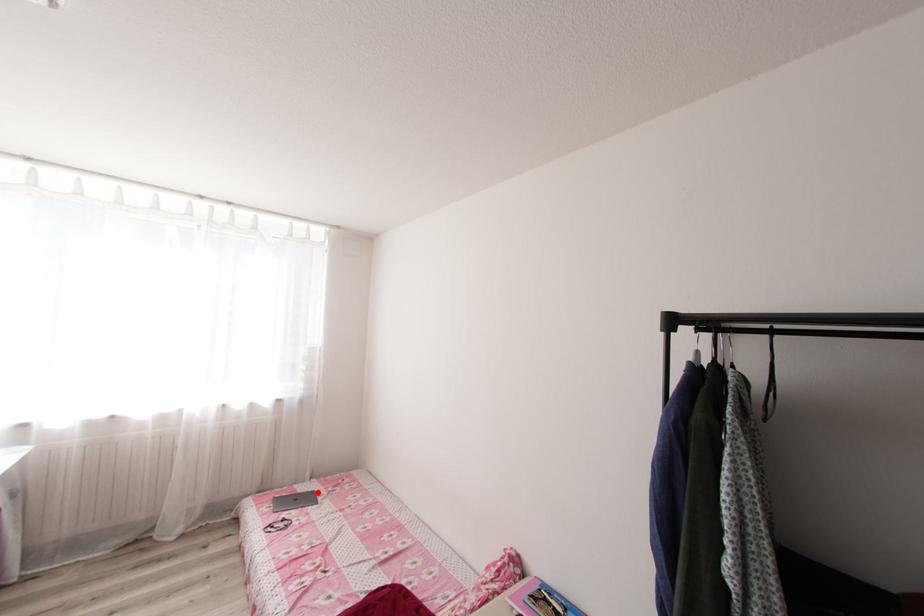
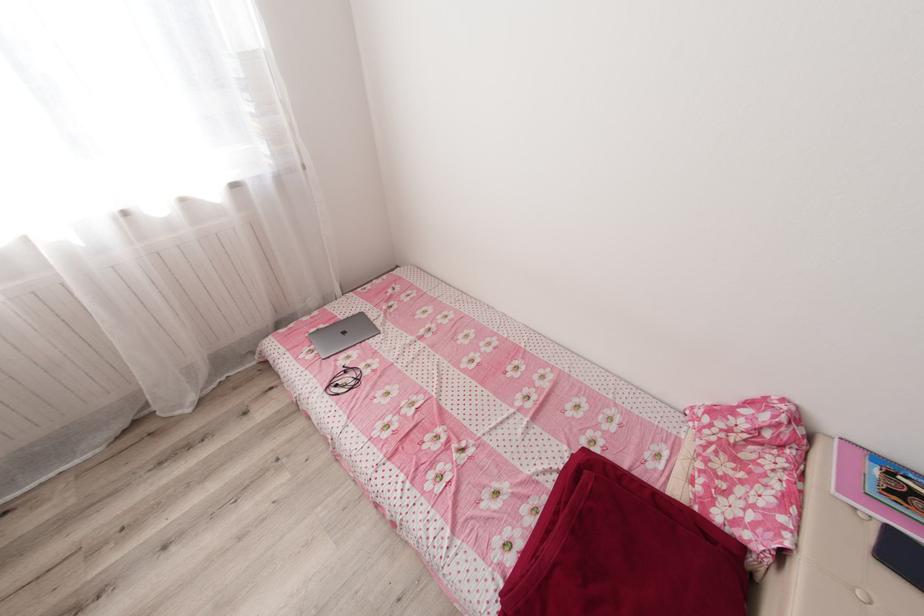
The point at the highlighted location is marked in the first image. Where is the corresponding point in the second image?

(367, 315)